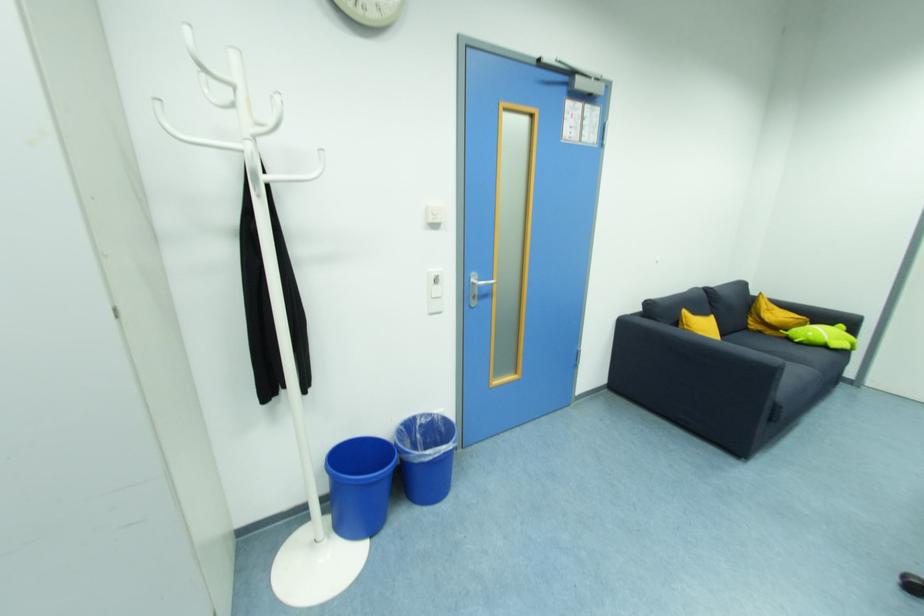
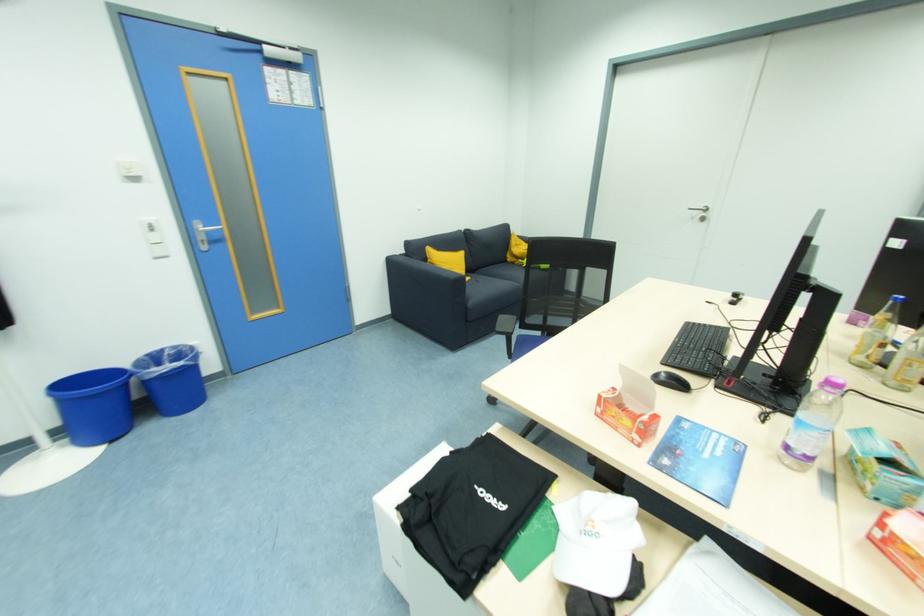
Where in the second image is the point corresponding to pixel 762 334 from the first image?

(516, 265)